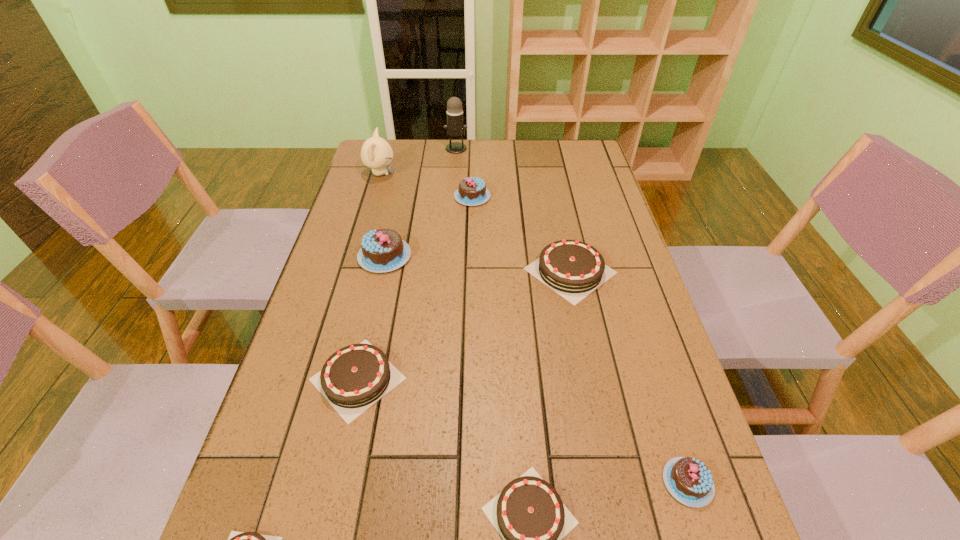
I want to click on the second farthest brown chocolate cake, so click(355, 377).

You are a GUI agent. You are given a task and a screenshot of the screen. Output one action in this format:
    pyautogui.click(x=<x>, y=<y>)
    Task: Click on the nearest pink chocolate cake
    The height and width of the screenshot is (540, 960).
    Given the screenshot: What is the action you would take?
    pyautogui.click(x=689, y=481)

Identify the location of the rightmost pink chocolate cake. The width and height of the screenshot is (960, 540). (689, 481).

What are the coordinates of `free space located on the front of the microphone` in the screenshot? It's located at (452, 213).

Locate an element on the screen. Image resolution: width=960 pixels, height=540 pixels. vacant space situated on the face of the kitten is located at coordinates (447, 173).

You are a GUI agent. You are given a task and a screenshot of the screen. Output one action in this format:
    pyautogui.click(x=<x>, y=<y>)
    Task: Click on the vacant area located 0.190m on the front of the third tallest object
    
    Given the screenshot: What is the action you would take?
    pyautogui.click(x=368, y=331)

Locate an element on the screen. vacant area situated on the back of the farthest chocolate cake is located at coordinates (472, 178).

Where is `free space located 0.400m on the back of the farthest brown chocolate cake`? The image size is (960, 540). free space located 0.400m on the back of the farthest brown chocolate cake is located at coordinates (549, 167).

At what (x,y) coordinates should I click in order to perform the action: click on vacant region located 0.080m on the right of the second biggest brown chocolate cake. Please return your answer as a coordinate pair (x, y). The height and width of the screenshot is (540, 960). Looking at the image, I should click on (444, 379).

You are a GUI agent. You are given a task and a screenshot of the screen. Output one action in this format:
    pyautogui.click(x=<x>, y=<y>)
    Task: Click on the vacant space situated on the left of the nearest pink chocolate cake
    Image resolution: width=960 pixels, height=540 pixels.
    Given the screenshot: What is the action you would take?
    pyautogui.click(x=444, y=482)